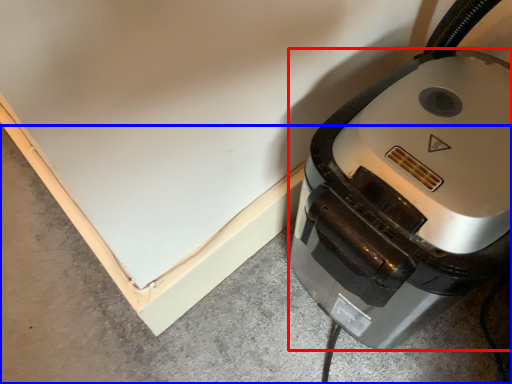
Question: Which of the following is the farthest to the observer, home appliance (highlighted by a red box) or concrete (highlighted by a blue box)?

Choices:
 (A) home appliance
 (B) concrete

Answer: (B)